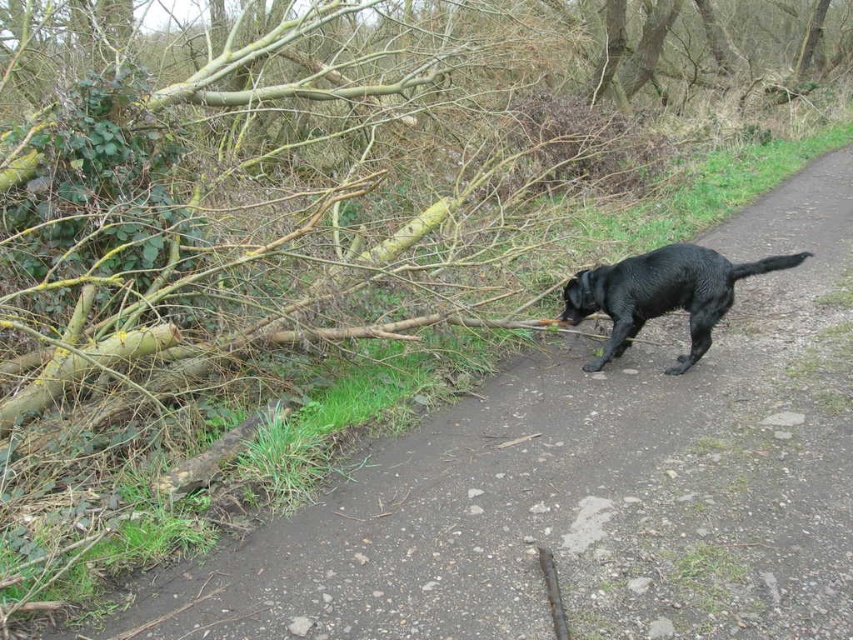
Is brown wood log at left positioned behind shiny black dog at center-right?

That is False.

Which of these two, brown wood log at left or shiny black dog at center-right, stands taller?

brown wood log at left is taller.

The height and width of the screenshot is (640, 853). I want to click on brown wood log at left, so click(x=572, y=486).